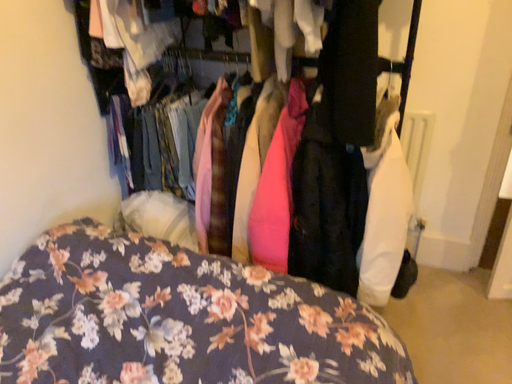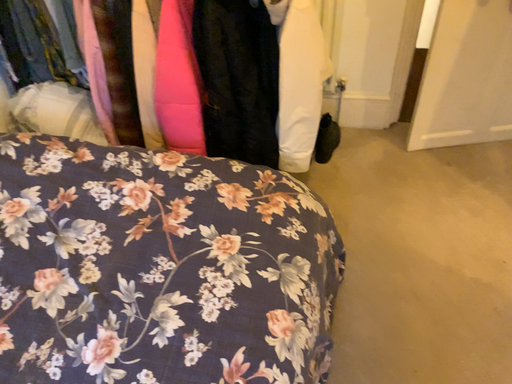
Question: How did the camera likely rotate when shooting the video?

Choices:
 (A) rotated downward
 (B) rotated upward

Answer: (A)